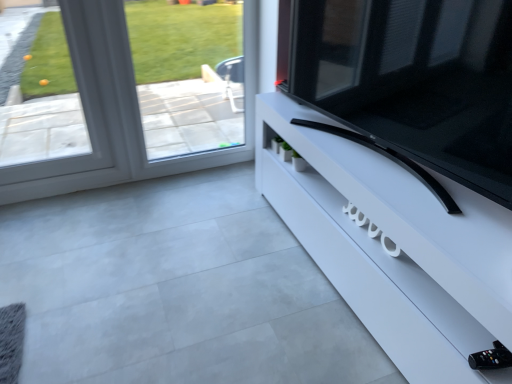
Question: Considering the relative sizes of black glossy tv at right and clear glass window at upper left in the image provided, is black glossy tv at right taller than clear glass window at upper left?

Choices:
 (A) no
 (B) yes

Answer: (A)

Question: Is black glossy tv at right outside clear glass window at upper left?

Choices:
 (A) yes
 (B) no

Answer: (A)

Question: Is the position of black glossy tv at right more distant than that of clear glass window at upper left?

Choices:
 (A) yes
 (B) no

Answer: (B)

Question: Is black glossy tv at right far from clear glass window at upper left?

Choices:
 (A) yes
 (B) no

Answer: (A)

Question: Is clear glass window at upper left inside black glossy tv at right?

Choices:
 (A) yes
 (B) no

Answer: (B)

Question: From the image's perspective, is black glossy tv at right on top of clear glass window at upper left?

Choices:
 (A) yes
 (B) no

Answer: (B)

Question: Is black glossy tv at right looking in the opposite direction of white glossy tv stand at right?

Choices:
 (A) yes
 (B) no

Answer: (B)

Question: Is black glossy tv at right positioned behind white glossy tv stand at right?

Choices:
 (A) no
 (B) yes

Answer: (A)

Question: Could you tell me if black glossy tv at right is facing white glossy tv stand at right?

Choices:
 (A) no
 (B) yes

Answer: (A)

Question: Is black glossy tv at right smaller than white glossy tv stand at right?

Choices:
 (A) no
 (B) yes

Answer: (B)

Question: Are black glossy tv at right and white glossy tv stand at right beside each other?

Choices:
 (A) no
 (B) yes

Answer: (A)

Question: From the image's perspective, is black glossy tv at right above white glossy tv stand at right?

Choices:
 (A) no
 (B) yes

Answer: (B)

Question: Can you confirm if clear glass window at upper left is taller than white glossy tv stand at right?

Choices:
 (A) no
 (B) yes

Answer: (B)